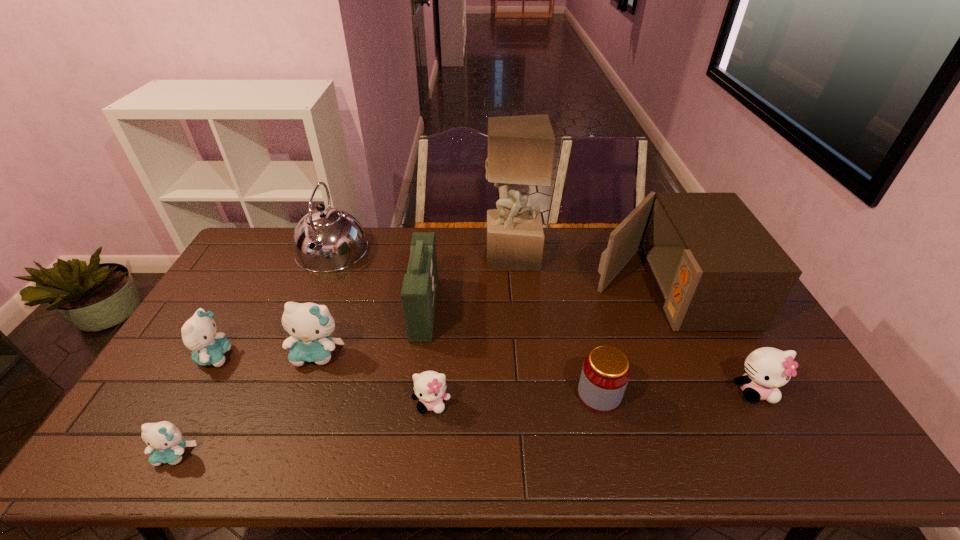
What are the coordinates of `the third object from right to left` in the screenshot? It's located at (605, 373).

You are a GUI agent. You are given a task and a screenshot of the screen. Output one action in this format:
    pyautogui.click(x=<x>, y=<y>)
    Task: Click on the red jar
    This screenshot has height=540, width=960.
    Given the screenshot: What is the action you would take?
    pyautogui.click(x=605, y=373)

You are a GUI agent. You are given a task and a screenshot of the screen. Output one action in this format:
    pyautogui.click(x=<x>, y=<y>)
    Task: Click on the fourth kitten from left to right
    
    Given the screenshot: What is the action you would take?
    pyautogui.click(x=429, y=386)

Identify the location of the left white kitten. The width and height of the screenshot is (960, 540). (429, 386).

The height and width of the screenshot is (540, 960). I want to click on the nearest blue kitten, so click(165, 443).

Where is `the nearest kitten`? Image resolution: width=960 pixels, height=540 pixels. the nearest kitten is located at coordinates (165, 443).

This screenshot has width=960, height=540. Identify the location of vacant space positioned on the front-facing side of the gray sculpture. (406, 255).

Image resolution: width=960 pixels, height=540 pixels. I want to click on free point located on the front-facing side of the gray sculpture, so click(x=468, y=255).

Where is `free space located on the front-facing side of the gray sculpture`? The width and height of the screenshot is (960, 540). free space located on the front-facing side of the gray sculpture is located at coordinates (422, 255).

Locate an element on the screen. This screenshot has width=960, height=540. vacant space located 0.160m from the spout of the kettle is located at coordinates (306, 311).